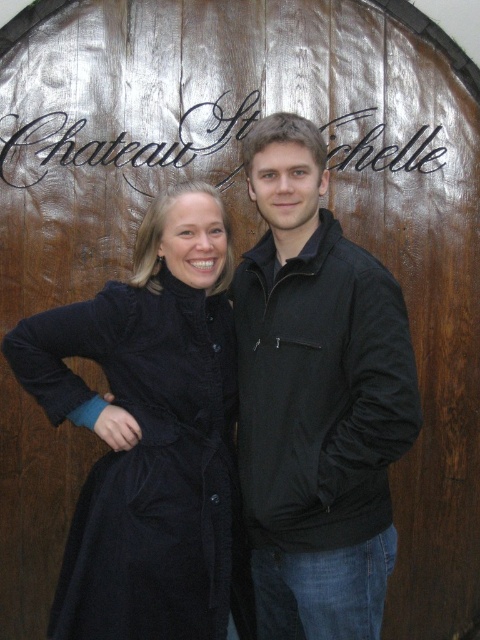
Question: Considering the relative positions of black matte jacket at center and velvet black coat at left in the image provided, where is black matte jacket at center located with respect to velvet black coat at left?

Choices:
 (A) right
 (B) left

Answer: (A)

Question: Can you confirm if black matte jacket at center is bigger than velvet black coat at left?

Choices:
 (A) no
 (B) yes

Answer: (A)

Question: Which object appears closest to the camera in this image?

Choices:
 (A) velvet black coat at left
 (B) black matte jacket at center

Answer: (A)

Question: Does black matte jacket at center appear on the right side of velvet black coat at left?

Choices:
 (A) no
 (B) yes

Answer: (B)